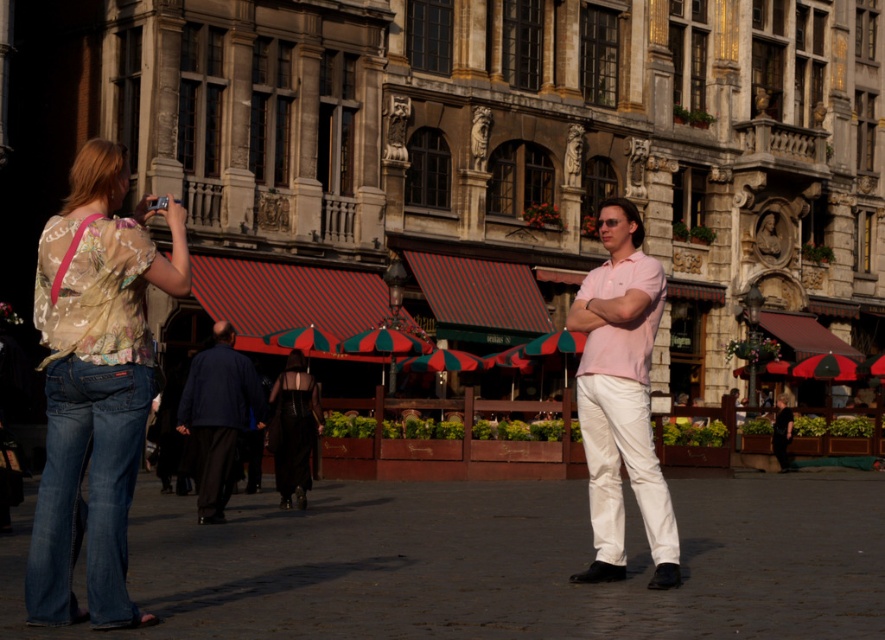
Can you confirm if matte pink shirt at center is positioned to the right of dark blue fabric jacket at center?

Correct, you'll find matte pink shirt at center to the right of dark blue fabric jacket at center.

Is point (620, 221) behind point (212, 380)?

No, (620, 221) is in front of (212, 380).

Where is `matte pink shirt at center`? The image size is (885, 640). matte pink shirt at center is located at coordinates (621, 397).

Measure the distance between denim jeans at left and dark blue fabric jacket at center.

They are 43.34 feet apart.

Between denim jeans at left and dark blue fabric jacket at center, which one appears on the right side from the viewer's perspective?

From the viewer's perspective, dark blue fabric jacket at center appears more on the right side.

Is point (150, 348) farther from viewer compared to point (216, 506)?

No, (150, 348) is in front of (216, 506).

Identify the location of denim jeans at left. The height and width of the screenshot is (640, 885). (95, 384).

Is dark blue fabric jacket at center to the left of black satin dress at center from the viewer's perspective?

Correct, you'll find dark blue fabric jacket at center to the left of black satin dress at center.

Consider the image. Is dark blue fabric jacket at center in front of black satin dress at center?

Yes, it is.

Is point (264, 417) behind point (294, 480)?

No, (264, 417) is in front of (294, 480).

At what (x,y) coordinates should I click in order to perform the action: click on dark blue fabric jacket at center. Please return your answer as a coordinate pair (x, y). Looking at the image, I should click on (217, 417).